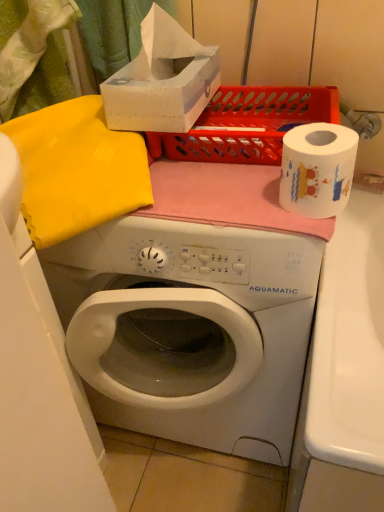
Question: From the image's perspective, is white cardboard tissue box at upper center positioned above or below white plastic washing machine at center?

Choices:
 (A) above
 (B) below

Answer: (A)

Question: Is white cardboard tissue box at upper center in front of or behind white plastic washing machine at center in the image?

Choices:
 (A) front
 (B) behind

Answer: (B)

Question: Which object is the farthest from the white cardboard tissue box at upper center?

Choices:
 (A) matte plastic crate at upper center
 (B) white paper at right
 (C) white plastic washing machine at center

Answer: (C)

Question: Based on their relative distances, which object is farther from the white plastic washing machine at center?

Choices:
 (A) white cardboard tissue box at upper center
 (B) matte plastic crate at upper center
 (C) white paper at right

Answer: (A)